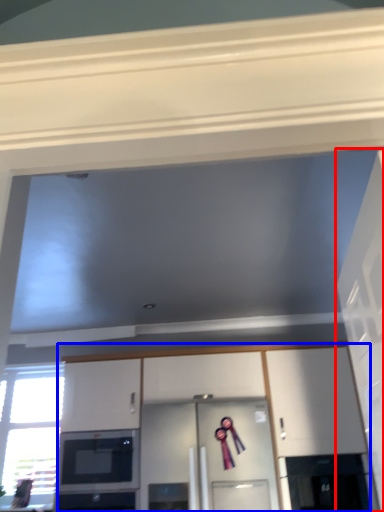
Question: Which object appears farthest to the camera in this image, door (highlighted by a red box) or cabinetry (highlighted by a blue box)?

Choices:
 (A) door
 (B) cabinetry

Answer: (B)